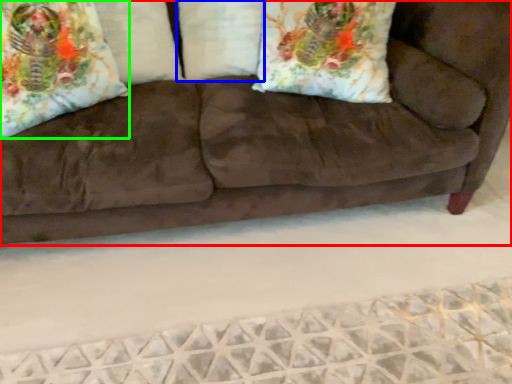
Question: Estimate the real-world distances between objects in this image. Which object is closer to studio couch (highlighted by a red box), pillow (highlighted by a blue box) or throw pillow (highlighted by a green box)?

Choices:
 (A) pillow
 (B) throw pillow

Answer: (A)